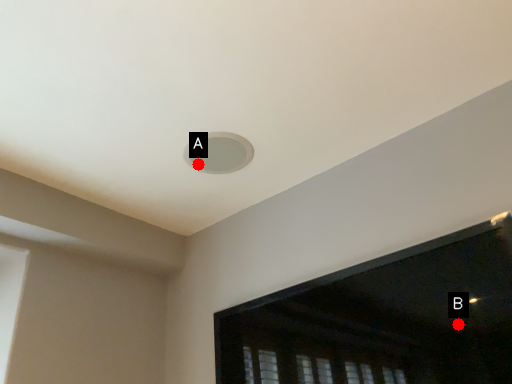
Question: Two points are circled on the image, labeled by A and B beside each circle. Which point appears closest to the camera in this image?

Choices:
 (A) A is closer
 (B) B is closer

Answer: (B)